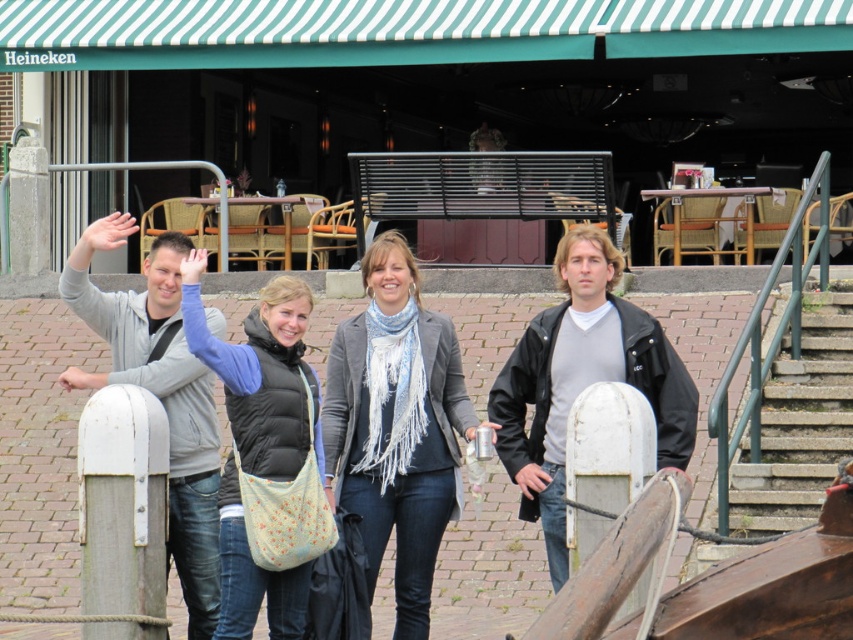
Question: Can you confirm if gray wool scarf at center is positioned above gray fleece jacket at left?

Choices:
 (A) yes
 (B) no

Answer: (A)

Question: Among these objects, which one is nearest to the camera?

Choices:
 (A) light skin tone hand at center
 (B) gray wool scarf at center
 (C) black leather jacket at center

Answer: (B)

Question: Is gray wool scarf at center above light blue quilted vest at center?

Choices:
 (A) no
 (B) yes

Answer: (A)

Question: Which of the following is the farthest from the observer?

Choices:
 (A) (653, 385)
 (B) (825, 333)
 (C) (73, 381)
 (D) (178, 467)

Answer: (B)

Question: Based on their relative distances, which object is nearer to the black leather jacket at center?

Choices:
 (A) gray fleece jacket at left
 (B) concrete stairs at right
 (C) gray wool scarf at center
 (D) white matte hand at upper left

Answer: (C)

Question: Is gray wool scarf at center in front of black leather jacket at center?

Choices:
 (A) yes
 (B) no

Answer: (A)